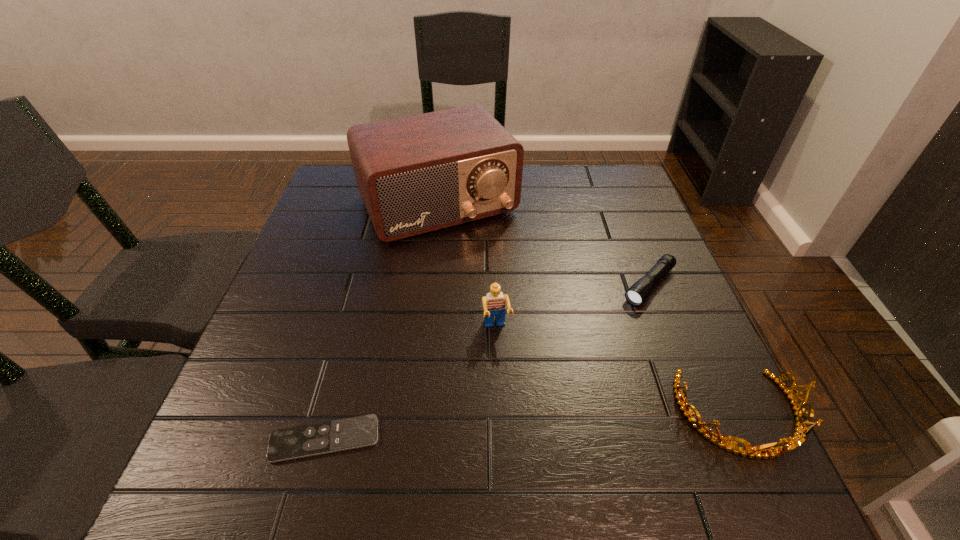
The width and height of the screenshot is (960, 540). Find the location of `free space between the fourth shortest object and the tiara`. free space between the fourth shortest object and the tiara is located at coordinates (618, 372).

The height and width of the screenshot is (540, 960). I want to click on unoccupied position between the flashlight and the third nearest object, so [x=573, y=307].

You are a GUI agent. You are given a task and a screenshot of the screen. Output one action in this format:
    pyautogui.click(x=<x>, y=<y>)
    Task: Click on the free space between the Lego and the shortest object
    Image resolution: width=960 pixels, height=540 pixels.
    Given the screenshot: What is the action you would take?
    point(411,384)

Identify the location of empty space that is in between the radio receiver and the tiara. This screenshot has width=960, height=540. (589, 309).

The image size is (960, 540). Find the location of `vacant space that is in between the flashlight and the tiara`. vacant space that is in between the flashlight and the tiara is located at coordinates tap(695, 350).

Locate an element on the screen. The height and width of the screenshot is (540, 960). vacant space in between the Lego and the flashlight is located at coordinates (573, 307).

Find the location of a particular element. This screenshot has width=960, height=540. empty location between the remote control and the tallest object is located at coordinates (381, 322).

Image resolution: width=960 pixels, height=540 pixels. In order to click on empty space between the fourth shortest object and the remote control in this screenshot , I will do `click(411, 384)`.

Identify the location of unoccupied area between the shortest object and the third tallest object. (533, 427).

This screenshot has width=960, height=540. Find the location of `empty space between the third farthest object and the tiara`. empty space between the third farthest object and the tiara is located at coordinates (618, 372).